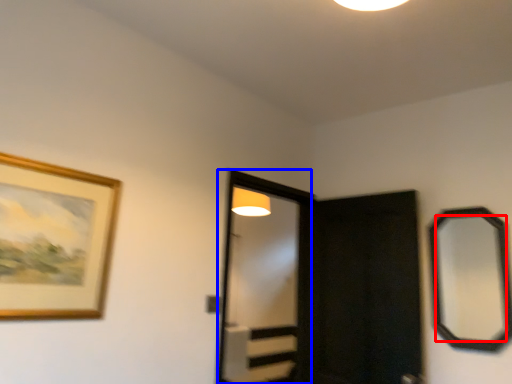
Question: Among these objects, which one is farthest to the camera, mirror (highlighted by a red box) or screen door (highlighted by a blue box)?

Choices:
 (A) mirror
 (B) screen door

Answer: (B)